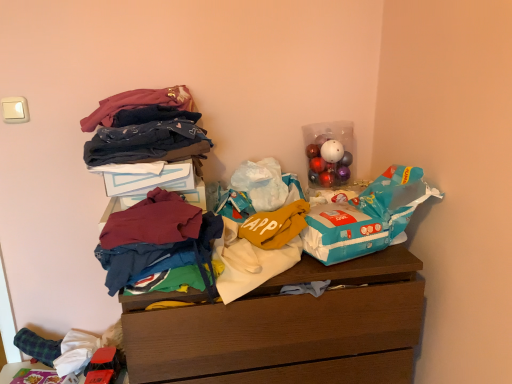
Question: Is velvet-like fabric at upper left, the fourth clothing ordered from the bottom, behind shiny plastic ornaments at upper right?

Choices:
 (A) no
 (B) yes

Answer: (A)

Question: From the image's perspective, is velvet-like fabric at upper left, the fourth clothing ordered from the bottom, on top of shiny plastic ornaments at upper right?

Choices:
 (A) no
 (B) yes

Answer: (B)

Question: Does velvet-like fabric at upper left, positioned as the first clothing in top-to-bottom order, have a greater width compared to shiny plastic ornaments at upper right?

Choices:
 (A) no
 (B) yes

Answer: (B)

Question: Does velvet-like fabric at upper left, the fourth clothing ordered from the bottom, have a smaller size compared to shiny plastic ornaments at upper right?

Choices:
 (A) no
 (B) yes

Answer: (A)

Question: Is shiny plastic ornaments at upper right at the back of velvet-like fabric at upper left, positioned as the first clothing in top-to-bottom order?

Choices:
 (A) no
 (B) yes

Answer: (A)

Question: Would you say shiny plastic ornaments at upper right is part of velvet-like fabric at upper left, the fourth clothing ordered from the bottom,'s contents?

Choices:
 (A) yes
 (B) no

Answer: (B)

Question: Is wooden chest of drawers at center taller than shiny plastic ornaments at upper right?

Choices:
 (A) no
 (B) yes

Answer: (B)

Question: Is wooden chest of drawers at center positioned in front of shiny plastic ornaments at upper right?

Choices:
 (A) yes
 (B) no

Answer: (A)

Question: From a real-world perspective, does wooden chest of drawers at center stand above shiny plastic ornaments at upper right?

Choices:
 (A) no
 (B) yes

Answer: (A)

Question: Considering the relative positions of wooden chest of drawers at center and shiny plastic ornaments at upper right in the image provided, is wooden chest of drawers at center behind shiny plastic ornaments at upper right?

Choices:
 (A) no
 (B) yes

Answer: (A)

Question: Is wooden chest of drawers at center placed right next to shiny plastic ornaments at upper right?

Choices:
 (A) no
 (B) yes

Answer: (A)

Question: Is shiny plastic ornaments at upper right a part of wooden chest of drawers at center?

Choices:
 (A) no
 (B) yes

Answer: (A)

Question: Is velvet-like fabric at upper left, positioned as the first clothing in top-to-bottom order, thinner than blue plastic grocery bag at upper right?

Choices:
 (A) yes
 (B) no

Answer: (B)